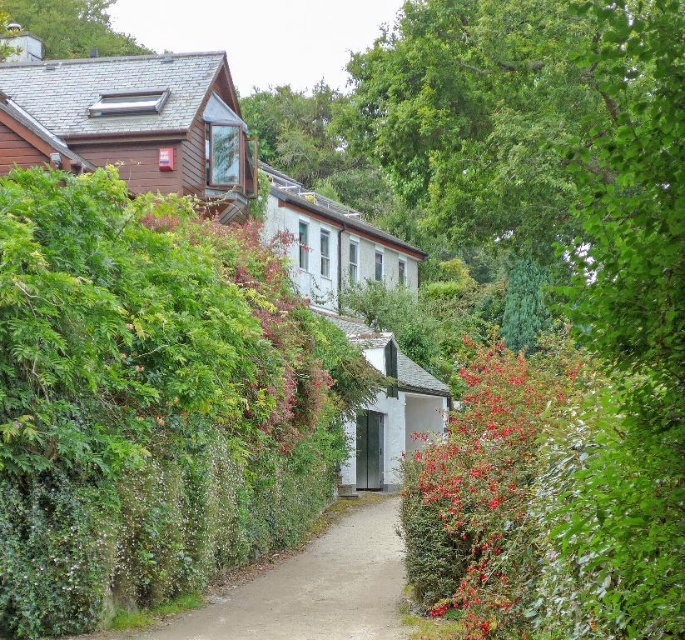
Is wooden cabin at upper left shorter than green leafy tree at upper left?

Correct, wooden cabin at upper left is not as tall as green leafy tree at upper left.

Does wooden cabin at upper left have a greater width compared to green leafy tree at upper left?

Yes, wooden cabin at upper left is wider than green leafy tree at upper left.

Does point (38, 140) come in front of point (90, 8)?

Yes, point (38, 140) is closer to viewer.

This screenshot has width=685, height=640. In order to click on wooden cabin at upper left in this screenshot , I will do `click(134, 122)`.

Is wooden cabin at upper left to the right of dirt path at center from the viewer's perspective?

Incorrect, wooden cabin at upper left is not on the right side of dirt path at center.

Who is more forward, (240, 118) or (323, 612)?

Point (323, 612) is more forward.

Who is more distant from viewer, [149,177] or [212,609]?

Point [149,177]

Identify the location of wooden cabin at upper left. (134, 122).

Is dirt path at center to the left of white matte cottage at center from the viewer's perspective?

No, dirt path at center is not to the left of white matte cottage at center.

Where is `dirt path at center`? dirt path at center is located at coordinates (311, 588).

At what (x,y) coordinates should I click in order to perform the action: click on dirt path at center. Please return your answer as a coordinate pair (x, y). Looking at the image, I should click on (311, 588).